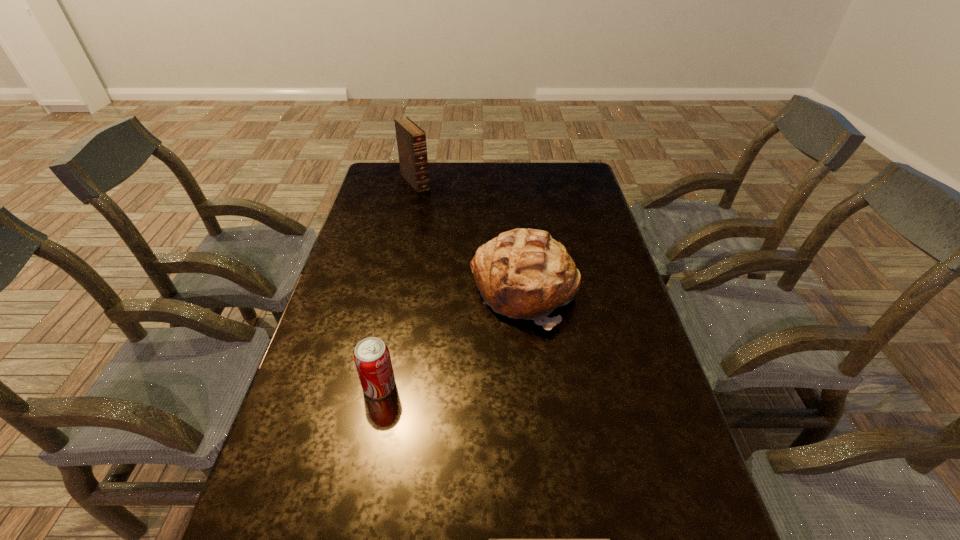
You are a GUI agent. You are given a task and a screenshot of the screen. Output one action in this format:
    pyautogui.click(x=<x>, y=<y>)
    Task: Click on the tallest object
    This screenshot has width=960, height=540.
    Given the screenshot: What is the action you would take?
    pyautogui.click(x=411, y=140)

Locate an element on the screen. This screenshot has height=540, width=960. the taller Bible is located at coordinates (411, 140).

Where is `the second tallest object`? Image resolution: width=960 pixels, height=540 pixels. the second tallest object is located at coordinates (523, 273).

At what (x,y) coordinates should I click in order to perform the action: click on the second farthest object. Please return your answer as a coordinate pair (x, y). This screenshot has width=960, height=540. Looking at the image, I should click on (523, 273).

The width and height of the screenshot is (960, 540). Find the location of `the third tallest object`. the third tallest object is located at coordinates (372, 359).

This screenshot has width=960, height=540. I want to click on soda can, so click(x=372, y=359).

This screenshot has height=540, width=960. Find the location of `free space located 0.070m on the front of the left Bible`. free space located 0.070m on the front of the left Bible is located at coordinates (411, 203).

Identify the location of vacant space situated on the right of the third nearest object. This screenshot has width=960, height=540. (599, 291).

At what (x,y) coordinates should I click in order to perform the action: click on vacant area located on the right of the second nearest object. Please return your answer as a coordinate pair (x, y). The width and height of the screenshot is (960, 540). Looking at the image, I should click on (535, 386).

You are a GUI agent. You are given a task and a screenshot of the screen. Output one action in this format:
    pyautogui.click(x=<x>, y=<y>)
    Task: Click on the object that is at the far edge
    
    Given the screenshot: What is the action you would take?
    pyautogui.click(x=411, y=140)